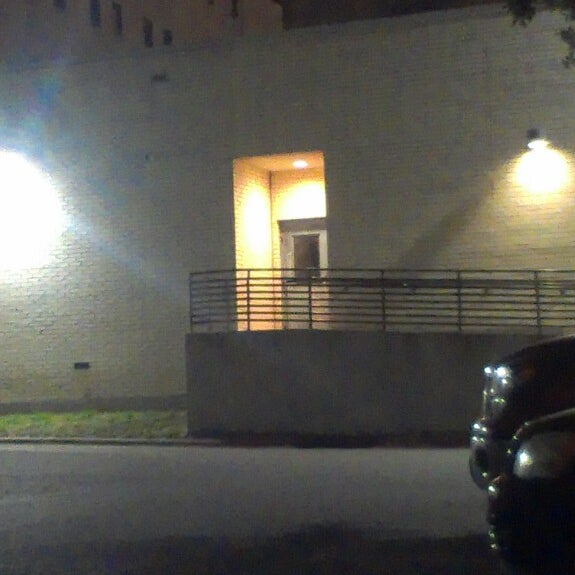
The height and width of the screenshot is (575, 575). In order to click on window in door in this screenshot , I will do `click(301, 251)`.